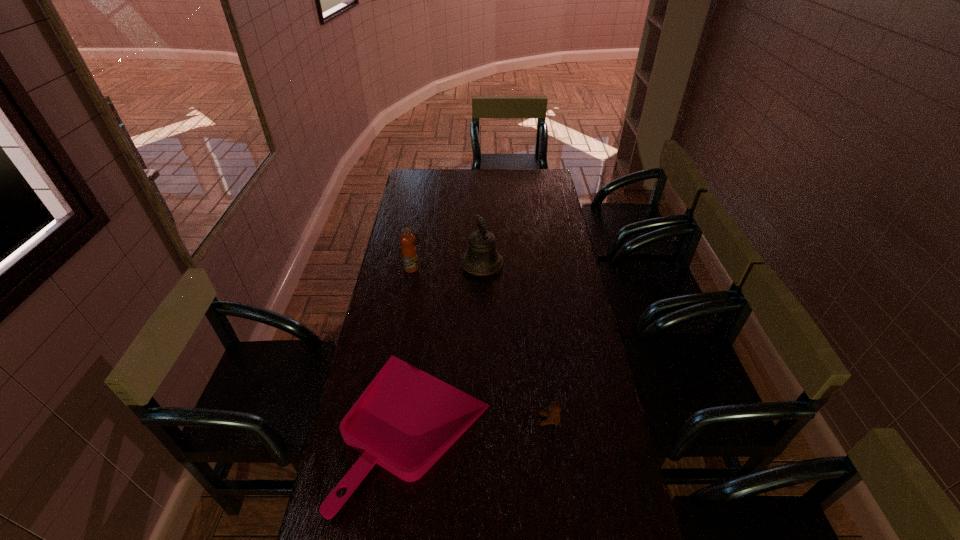
Identify the location of fruit juice that is at the left edge. (408, 250).

Find the location of a particular element. dustpan positioned at the left edge is located at coordinates (406, 419).

The width and height of the screenshot is (960, 540). Find the location of `vacant space at the far edge of the desktop`. vacant space at the far edge of the desktop is located at coordinates (496, 187).

The width and height of the screenshot is (960, 540). What are the coordinates of `free space at the left edge of the desktop` in the screenshot? It's located at (424, 218).

In the image, there is a desktop. Where is `free region at the right edge`? Image resolution: width=960 pixels, height=540 pixels. free region at the right edge is located at coordinates (535, 221).

Locate an element on the screen. free region at the far left corner is located at coordinates (415, 188).

Find the location of a particular element. The image size is (960, 540). free space between the fruit juice and the third tallest object is located at coordinates (480, 344).

This screenshot has width=960, height=540. What are the coordinates of `vacant space that is in between the dustpan and the rightmost object` in the screenshot? It's located at (483, 423).

At what (x,y) coordinates should I click in order to perform the action: click on empty space between the fruit juice and the shortest object. Please return your answer as a coordinate pair (x, y). Looking at the image, I should click on (415, 348).

The height and width of the screenshot is (540, 960). What are the coordinates of `free space that is in between the shortest object and the fruit juice` in the screenshot? It's located at (415, 348).